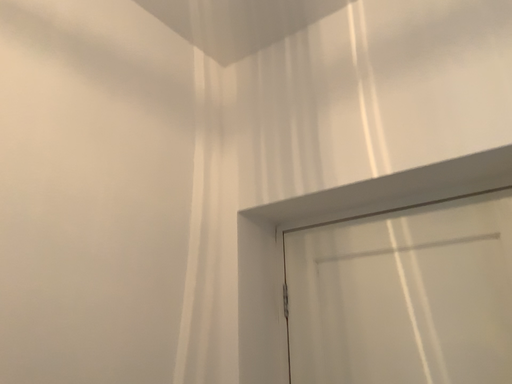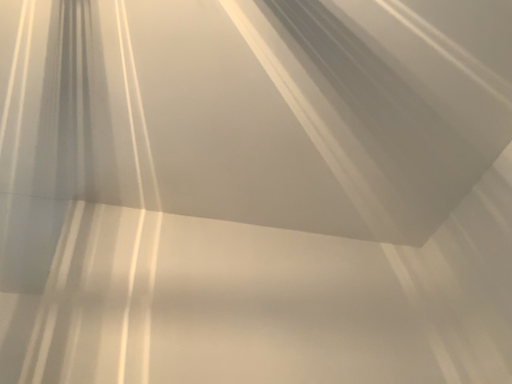
Question: How did the camera likely rotate when shooting the video?

Choices:
 (A) rotated left
 (B) rotated right

Answer: (A)